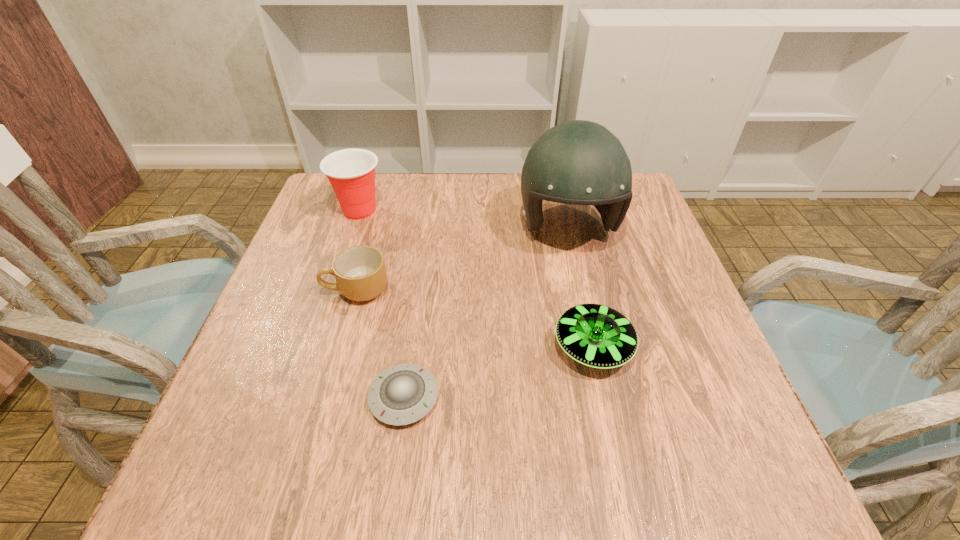
I want to click on free space between the football helmet and the cup, so click(x=464, y=219).

The width and height of the screenshot is (960, 540). I want to click on vacant space in between the shortest object and the fourth shortest object, so click(x=382, y=304).

You are a GUI agent. You are given a task and a screenshot of the screen. Output one action in this format:
    pyautogui.click(x=<x>, y=<y>)
    Task: Click on the free space between the taller saucer and the cup
    
    Given the screenshot: What is the action you would take?
    pyautogui.click(x=476, y=279)

What are the coordinates of `object that is the nearest to the third farthest object` in the screenshot? It's located at (403, 394).

Point out which object is positioned as the second nearest to the taller saucer. Please provide its 2D coordinates. Your answer should be formatted as a tuple, i.e. [(x, y)], where the tuple contains the x and y coordinates of a point satisfying the conditions above.

[(403, 394)]